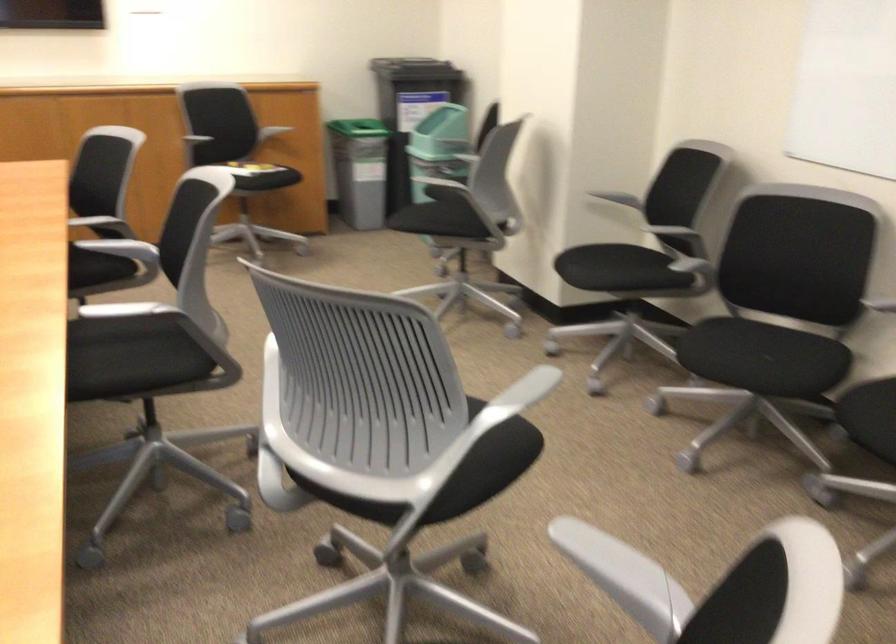
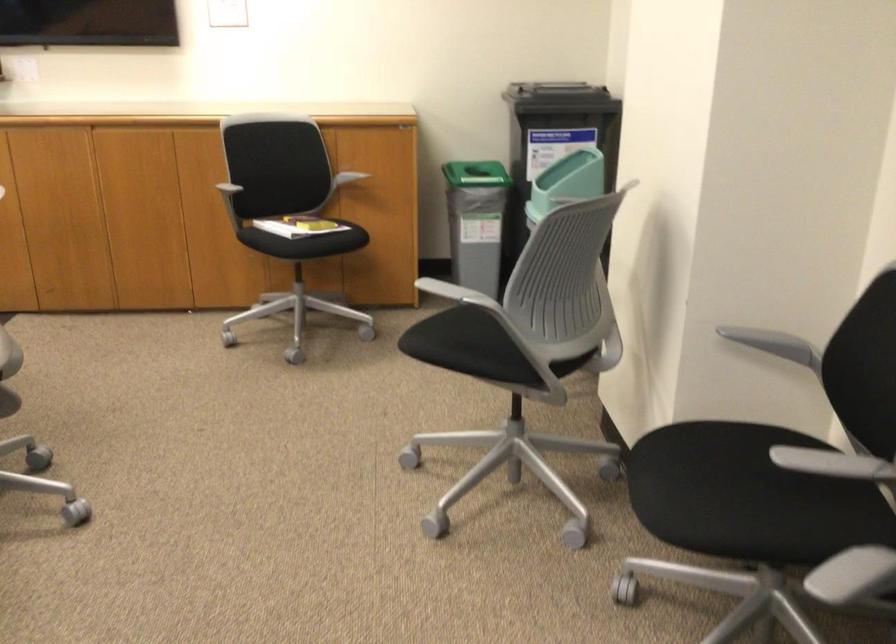
Question: What movement of the cameraman would produce the second image?

Choices:
 (A) Left
 (B) Right
 (C) Forward
 (D) Backward

Answer: (C)